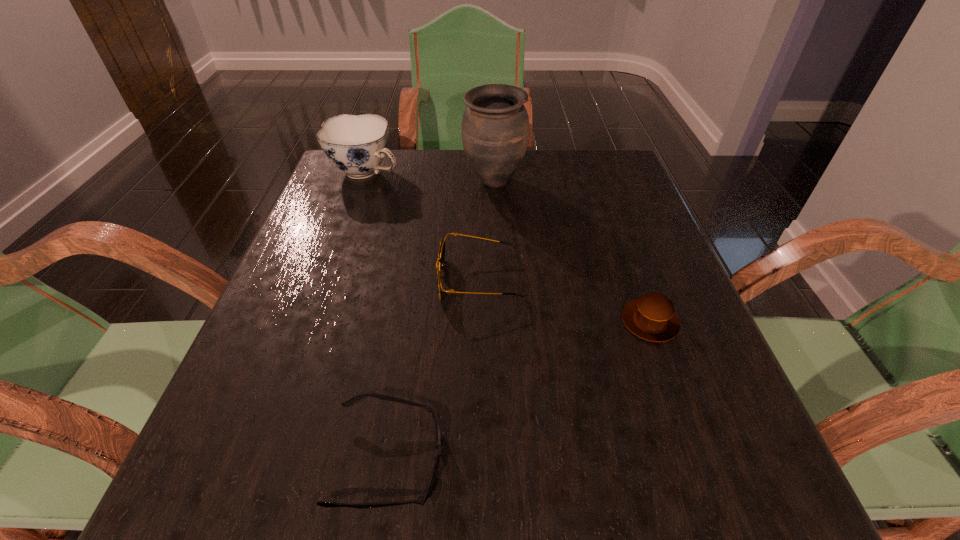
At what (x,y) coordinates should I click in order to perform the action: click on free location that satisfies the following two spatial constraints: 1. on the front side of the tallest object; 2. on the front-facing side of the taller sunglasses. Please return your answer as a coordinate pair (x, y). Looking at the image, I should click on click(x=498, y=280).